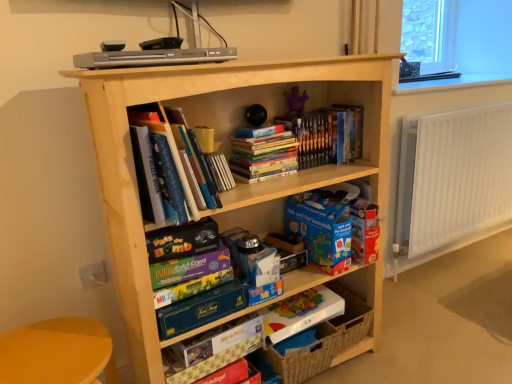
Question: From the image's perspective, relative to light wood bookcase at center, is hardcover books at center, the second book viewed from the right, above or below?

Choices:
 (A) below
 (B) above

Answer: (B)

Question: Considering their positions, is hardcover books at center, the second book viewed from the right, located in front of or behind light wood bookcase at center?

Choices:
 (A) front
 (B) behind

Answer: (B)

Question: Estimate the real-world distances between objects in this image. Which object is farther from the purple fabric toy at upper center?

Choices:
 (A) hardcover books at upper center, placed as the third book when sorted from left to right
 (B) clear glass window sill at upper right
 (C) woven brown basket at lower right
 (D) matte blue book at center, arranged as the first paperback book when viewed from the top
 (E) white metallic radiator at right

Answer: (E)

Question: Which object is positioned farthest from the woven brown basket at lower right?

Choices:
 (A) hardcover books at upper center, the 1th book viewed from the right
 (B) purple fabric toy at upper center
 (C) transparent glass window at upper right
 (D) blue cardboard book at center, the 2th paperback book in the top-to-bottom sequence
 (E) clear glass window sill at upper right

Answer: (C)